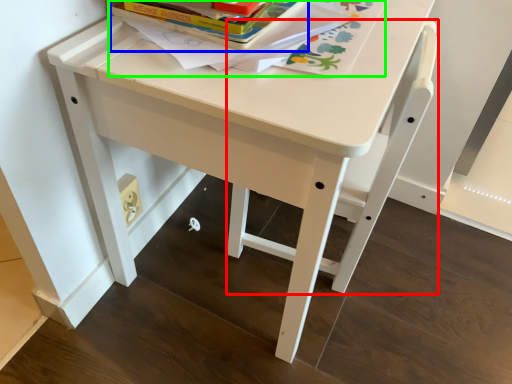
Question: Which is farther away from chair (highlighted by a red box)? paperback book (highlighted by a blue box) or book (highlighted by a green box)?

Choices:
 (A) paperback book
 (B) book

Answer: (A)